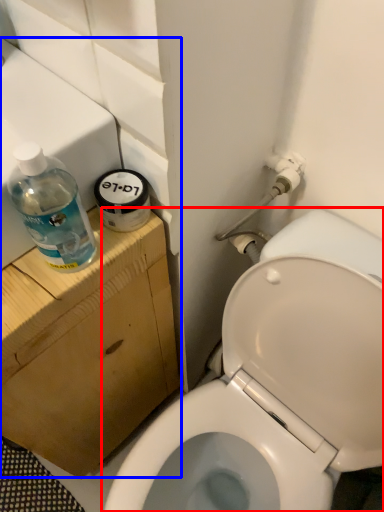
Question: Which of the following is the closest to the observer, toilet (highlighted by a red box) or sink (highlighted by a blue box)?

Choices:
 (A) toilet
 (B) sink

Answer: (A)